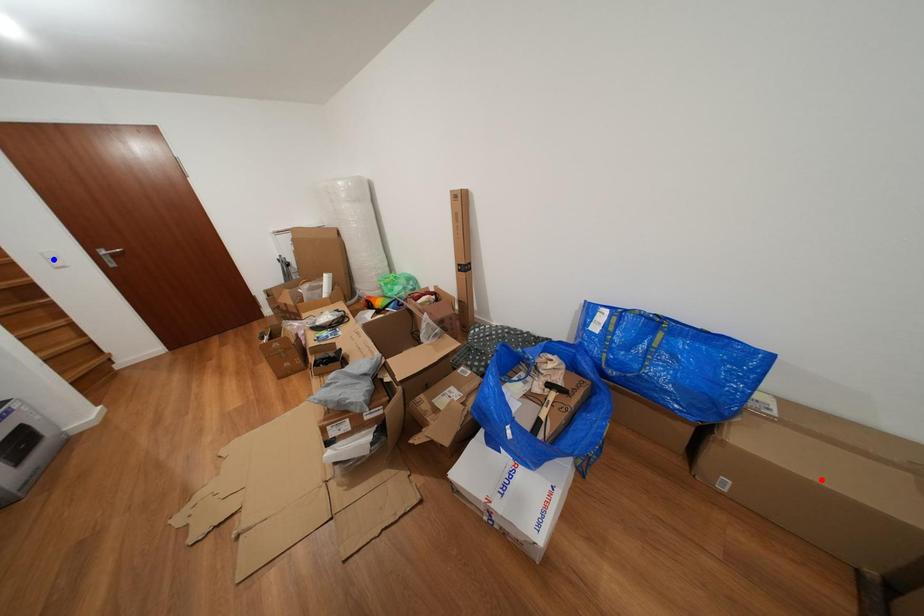
Question: Two points are marked on the image. Which point is closer to the camera?

Choices:
 (A) Blue point is closer.
 (B) Red point is closer.

Answer: (B)